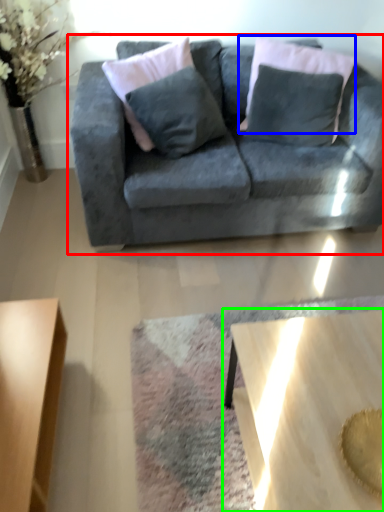
Question: Estimate the real-world distances between objects in this image. Which object is closer to studio couch (highlighted by a red box), pillow (highlighted by a blue box) or coffee table (highlighted by a green box)?

Choices:
 (A) pillow
 (B) coffee table

Answer: (A)